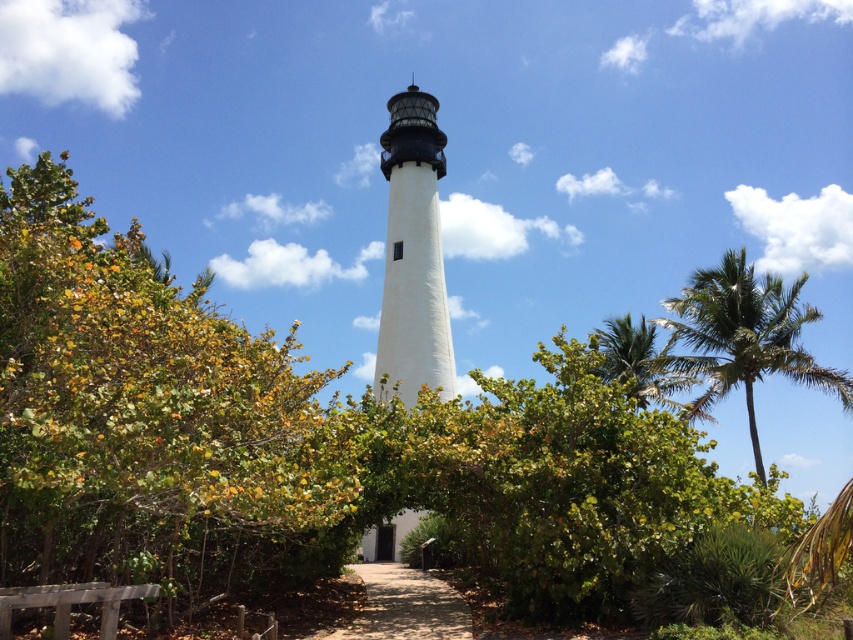
Is white smooth lighthouse at center further to camera compared to dirt path at center?

Yes.

Does point (403, 330) come in front of point (419, 596)?

No, (403, 330) is behind (419, 596).

The height and width of the screenshot is (640, 853). Identify the location of white smooth lighthouse at center. (413, 256).

Is point (154, 504) less distant than point (415, 616)?

Yes, point (154, 504) is in front of point (415, 616).

Who is more forward, (x=281, y=472) or (x=421, y=612)?

Positioned in front is point (x=281, y=472).

Locate an element on the screen. The height and width of the screenshot is (640, 853). green leafy bush at center is located at coordinates (146, 413).

Does dirt path at center have a larger size compared to green leafy palm tree at upper right?

Actually, dirt path at center might be smaller than green leafy palm tree at upper right.

Who is more distant from viewer, (x=450, y=620) or (x=666, y=397)?

Positioned behind is point (x=666, y=397).

You are a GUI agent. You are given a task and a screenshot of the screen. Output one action in this format:
    pyautogui.click(x=<x>, y=<y>)
    Task: Click on the dirt path at center
    This screenshot has width=853, height=640.
    Given the screenshot: What is the action you would take?
    pyautogui.click(x=405, y=605)